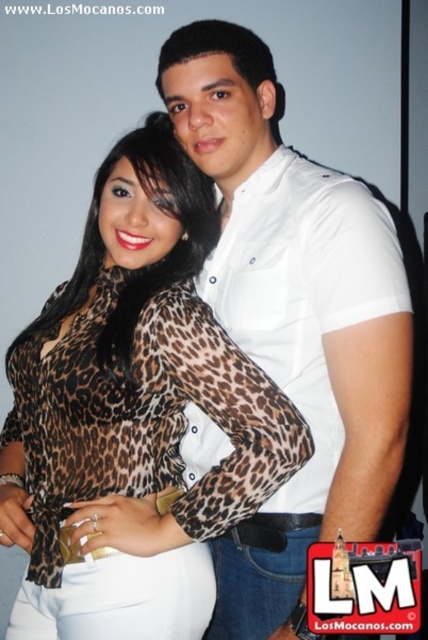
Question: Where is leopard print blouse at center located in relation to white smooth shirt at center in the image?

Choices:
 (A) right
 (B) left

Answer: (B)

Question: Is leopard print blouse at center above white smooth shirt at center?

Choices:
 (A) no
 (B) yes

Answer: (A)

Question: Is leopard print blouse at center to the right of white smooth shirt at center from the viewer's perspective?

Choices:
 (A) no
 (B) yes

Answer: (A)